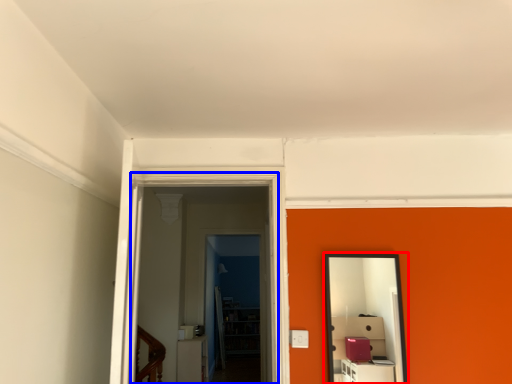
Question: Among these objects, which one is nearest to the camera, mirror (highlighted by a red box) or glass door (highlighted by a blue box)?

Choices:
 (A) mirror
 (B) glass door

Answer: (B)